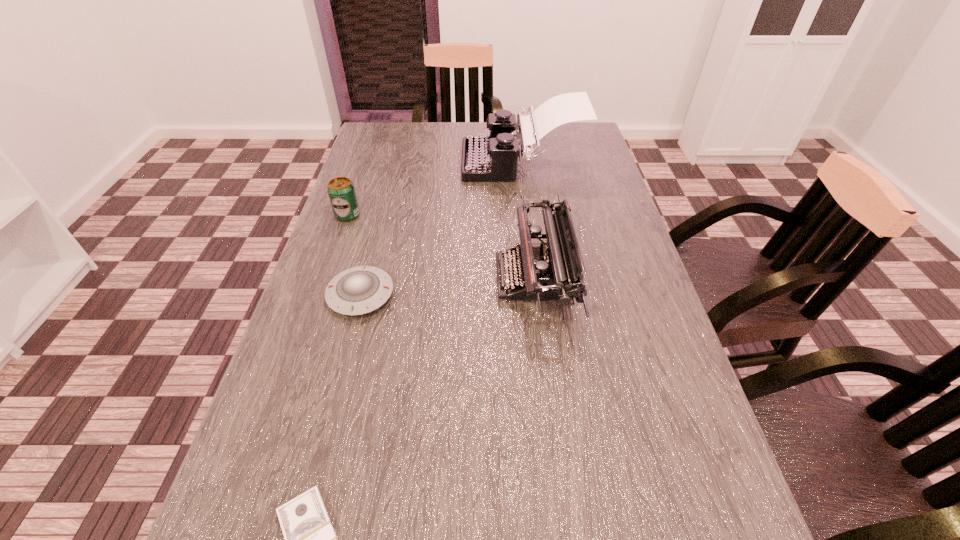
Identify the location of vacant space located on the typing side of the shorter typewriter. The image size is (960, 540). (330, 279).

Find the location of a particular element. The width and height of the screenshot is (960, 540). vacant region located on the typing side of the shorter typewriter is located at coordinates (396, 279).

You are a GUI agent. You are given a task and a screenshot of the screen. Output one action in this format:
    pyautogui.click(x=<x>, y=<y>)
    Task: Click on the free space located 0.310m on the typing side of the shorter typewriter
    
    Given the screenshot: What is the action you would take?
    (361, 279)

Locate an element on the screen. Image resolution: width=960 pixels, height=540 pixels. free space located on the back of the second farthest object is located at coordinates (366, 164).

This screenshot has width=960, height=540. In order to click on vacant space located 0.230m on the front of the second shortest object in this screenshot , I will do `click(327, 424)`.

Find the location of `object at the far edge`. object at the far edge is located at coordinates (487, 158).

This screenshot has width=960, height=540. I want to click on beer can at the left edge, so click(341, 191).

At what (x,y) coordinates should I click in order to perform the action: click on saucer at the left edge. Please return your answer as a coordinate pair (x, y). The height and width of the screenshot is (540, 960). Looking at the image, I should click on (359, 290).

Where is `object at the right edge`? The image size is (960, 540). object at the right edge is located at coordinates (487, 158).

Identify the location of object positioned at the far right corner. (487, 158).